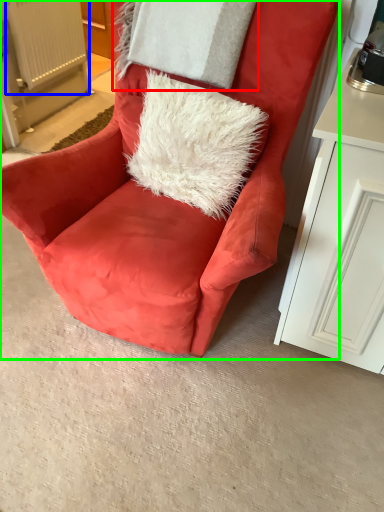
Question: Which object is positioned farthest from pillow (highlighted by a red box)? Select from radiator (highlighted by a blue box) and chair (highlighted by a green box).

Choices:
 (A) radiator
 (B) chair

Answer: (A)